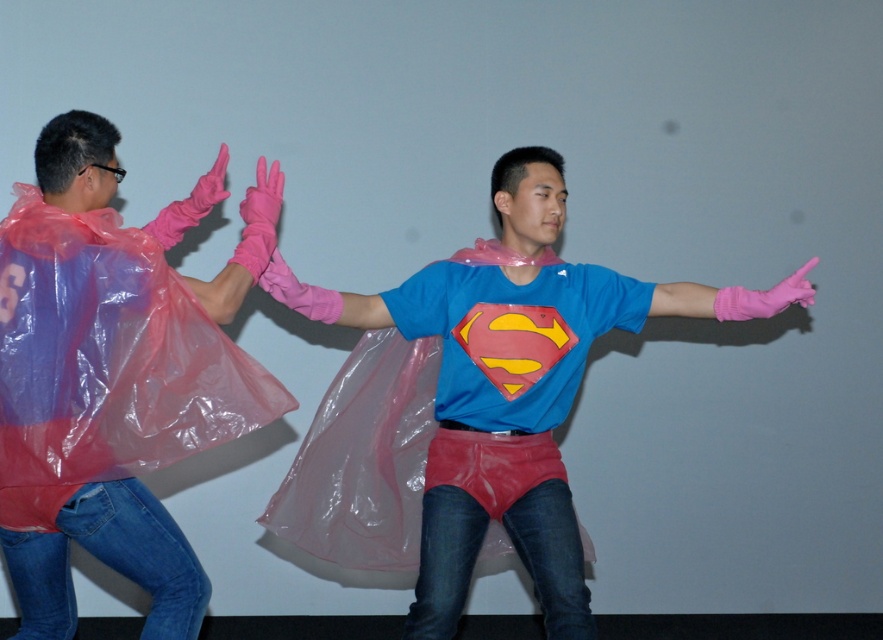
Question: Which point appears closest to the camera in this image?

Choices:
 (A) (497, 552)
 (B) (142, 570)

Answer: (B)

Question: Which of the following is the closest to the observer?

Choices:
 (A) pos(291,492)
 (B) pos(117,333)
 (C) pos(751,305)

Answer: (B)

Question: Is transparent plastic cape at left wider than blue fabric superman shirt at center?

Choices:
 (A) yes
 (B) no

Answer: (B)

Question: Can you confirm if transparent plastic cape at left is positioned to the right of matte plastic superman costume at center?

Choices:
 (A) yes
 (B) no

Answer: (B)

Question: Among these points, which one is farthest from the camera?

Choices:
 (A) (497, 244)
 (B) (504, 189)
 (C) (57, 458)

Answer: (A)

Question: Does matte plastic superman costume at center have a greater width compared to blue fabric superman shirt at center?

Choices:
 (A) no
 (B) yes

Answer: (B)